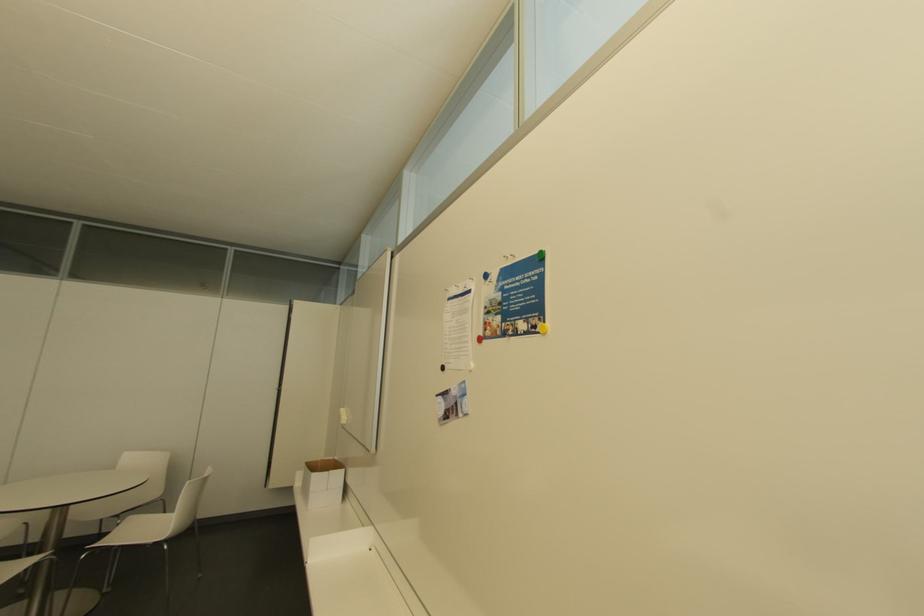
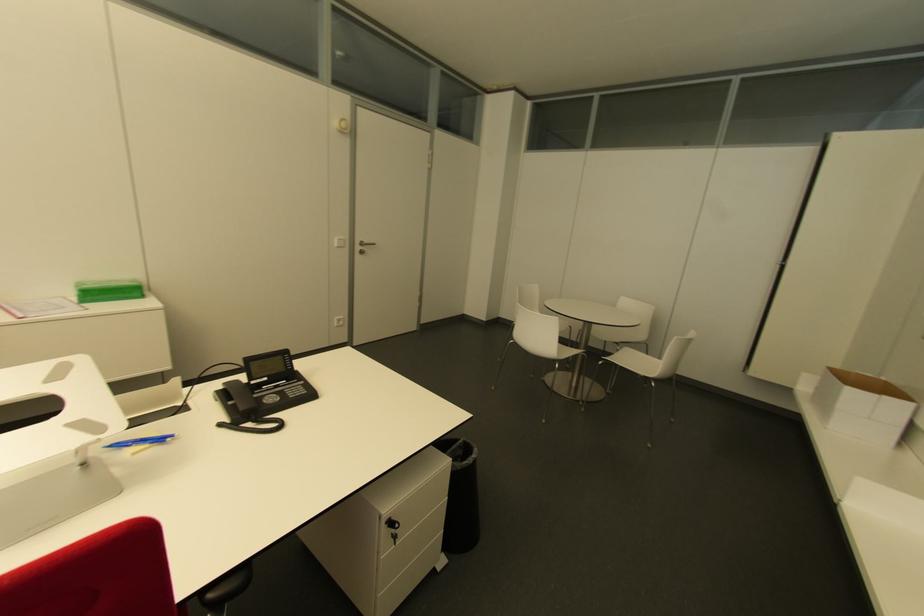
Where in the second image is the point corresponding to (x=329, y=459) from the first image?

(868, 376)